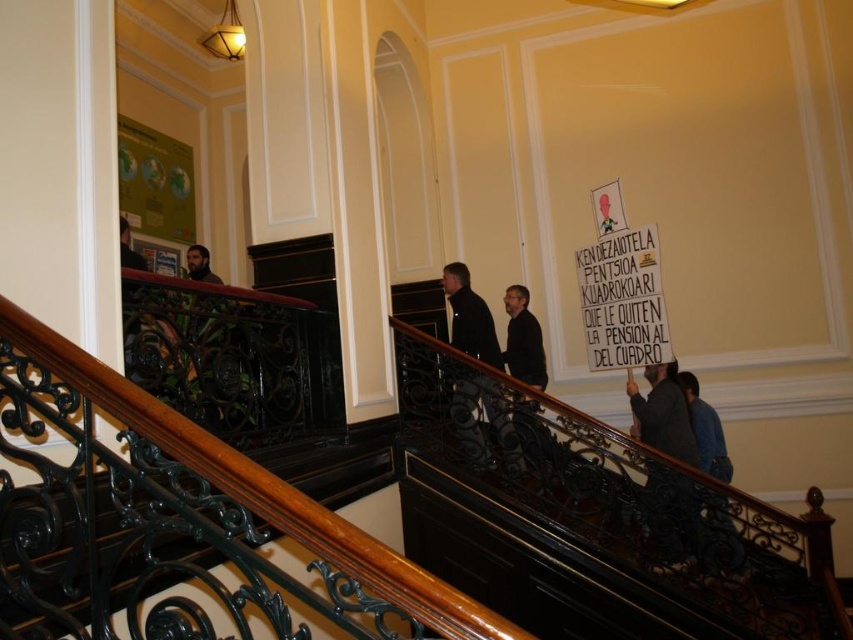
Question: Does black wrought iron at center appear under dark gray fabric jacket at lower right?

Choices:
 (A) yes
 (B) no

Answer: (B)

Question: Which object appears farthest from the camera in this image?

Choices:
 (A) blue denim jeans at lower right
 (B) black wrought iron at center
 (C) dark gray fabric jacket at lower right

Answer: (C)

Question: Among these objects, which one is farthest from the camera?

Choices:
 (A) dark gray fabric jacket at lower right
 (B) blue denim jeans at lower right

Answer: (A)

Question: Is dark gray fabric jacket at lower right thinner than blue denim jeans at lower right?

Choices:
 (A) yes
 (B) no

Answer: (B)

Question: Can you confirm if dark gray fabric jacket at lower right is positioned above blue denim jeans at lower right?

Choices:
 (A) no
 (B) yes

Answer: (B)

Question: Estimate the real-world distances between objects in this image. Which object is farther from the dark gray fabric jacket at lower right?

Choices:
 (A) blue denim jeans at lower right
 (B) black wrought iron at center

Answer: (B)